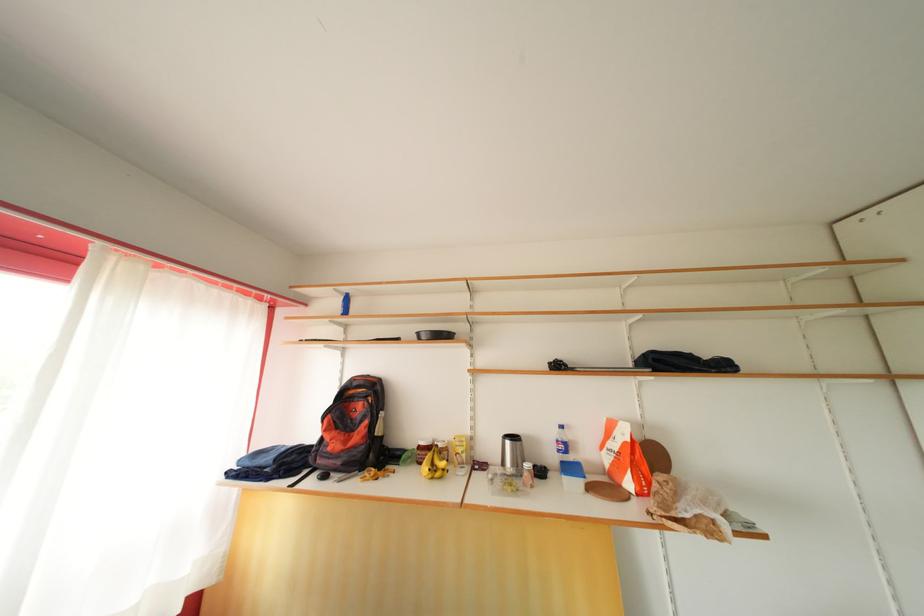
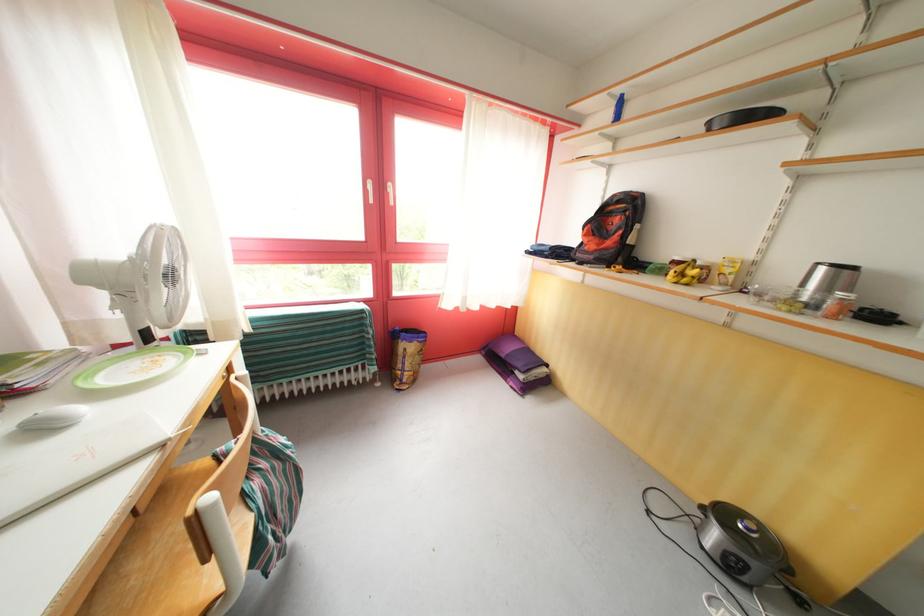
First-person continuous shooting, in which direction is the camera rotating?

The camera rotated toward left-down.